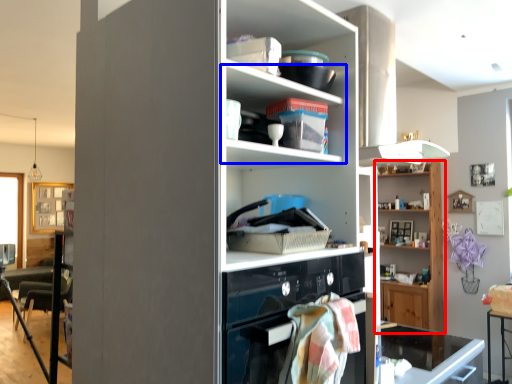
Question: Which object appears farthest to the camera in this image, shelf (highlighted by a red box) or shelf (highlighted by a blue box)?

Choices:
 (A) shelf
 (B) shelf

Answer: (A)